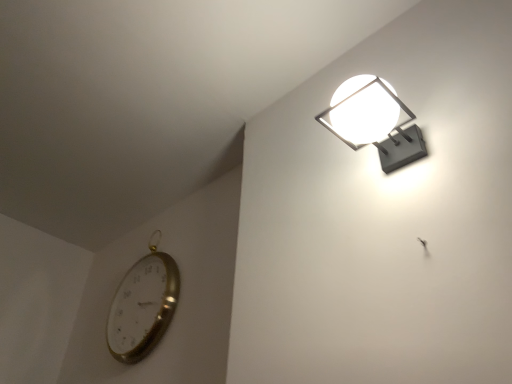
Question: From a real-world perspective, is gold metallic clock at lower left positioned over matte gray wall lamp at upper right based on gravity?

Choices:
 (A) no
 (B) yes

Answer: (B)

Question: From a real-world perspective, is gold metallic clock at lower left located beneath matte gray wall lamp at upper right?

Choices:
 (A) yes
 (B) no

Answer: (B)

Question: Is gold metallic clock at lower left looking in the opposite direction of matte gray wall lamp at upper right?

Choices:
 (A) no
 (B) yes

Answer: (A)

Question: Would you say gold metallic clock at lower left contains matte gray wall lamp at upper right?

Choices:
 (A) no
 (B) yes

Answer: (A)

Question: From the image's perspective, would you say gold metallic clock at lower left is shown under matte gray wall lamp at upper right?

Choices:
 (A) no
 (B) yes

Answer: (B)

Question: Is the depth of gold metallic clock at lower left less than that of matte gray wall lamp at upper right?

Choices:
 (A) no
 (B) yes

Answer: (A)

Question: Is there a large distance between matte gray wall lamp at upper right and gold metallic clock at lower left?

Choices:
 (A) yes
 (B) no

Answer: (A)

Question: Can you confirm if matte gray wall lamp at upper right is shorter than gold metallic clock at lower left?

Choices:
 (A) yes
 (B) no

Answer: (A)

Question: Does matte gray wall lamp at upper right contain gold metallic clock at lower left?

Choices:
 (A) yes
 (B) no

Answer: (B)

Question: Is matte gray wall lamp at upper right at the left side of gold metallic clock at lower left?

Choices:
 (A) no
 (B) yes

Answer: (A)

Question: Is matte gray wall lamp at upper right positioned beyond the bounds of gold metallic clock at lower left?

Choices:
 (A) no
 (B) yes

Answer: (B)

Question: Is matte gray wall lamp at upper right positioned with its back to gold metallic clock at lower left?

Choices:
 (A) yes
 (B) no

Answer: (B)

Question: In terms of size, does gold metallic clock at lower left appear bigger or smaller than matte gray wall lamp at upper right?

Choices:
 (A) big
 (B) small

Answer: (A)